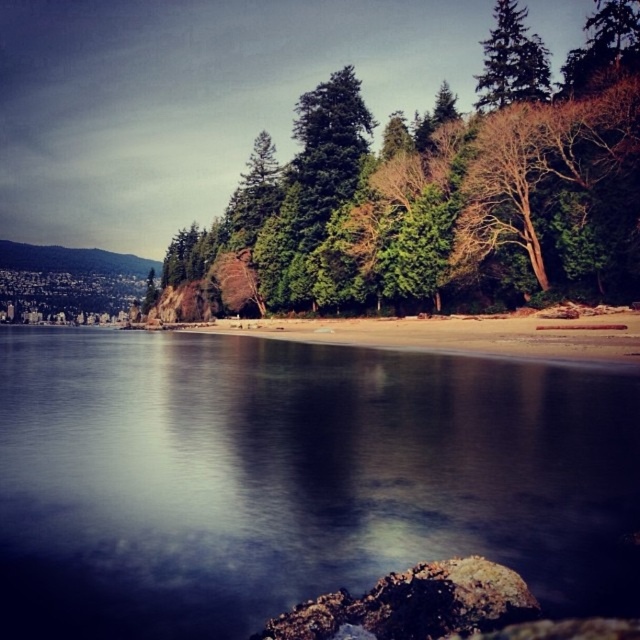
You are a photographer planning to capture the green textured tree at center and the brown sand at center in a single shot. Based on their sizes in the scene, which one will occupy more of the frame?

The green textured tree at center is larger in size than the brown sand at center, so it will occupy more of the frame.

You are standing on the beach and want to take a photo of the green matte tree at upper right without any foreground elements blocking it. Is the brown sand at center in front of the tree, making it hard to capture a clear shot?

Yes, the brown sand at center is in front of the green matte tree at upper right, which may block the view of the tree in your photo.